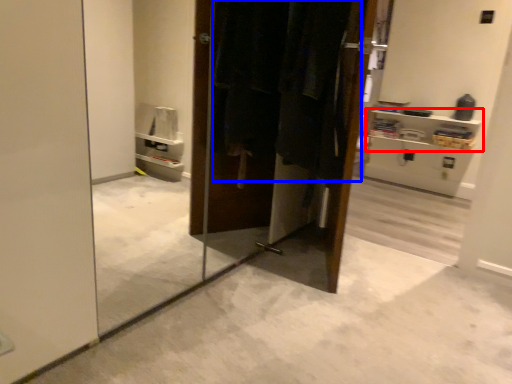
Question: Which point is closer to the camera, shelf (highlighted by a red box) or laundry (highlighted by a blue box)?

Choices:
 (A) shelf
 (B) laundry

Answer: (B)